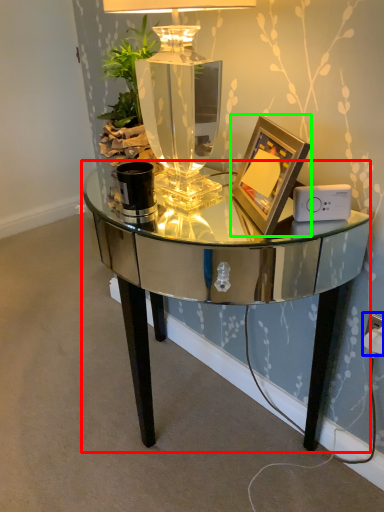
Question: Based on their relative distances, which object is farther from table (highlighted by a red box)? Choose from electric outlet (highlighted by a blue box) and picture frame (highlighted by a green box).

Choices:
 (A) electric outlet
 (B) picture frame

Answer: (A)